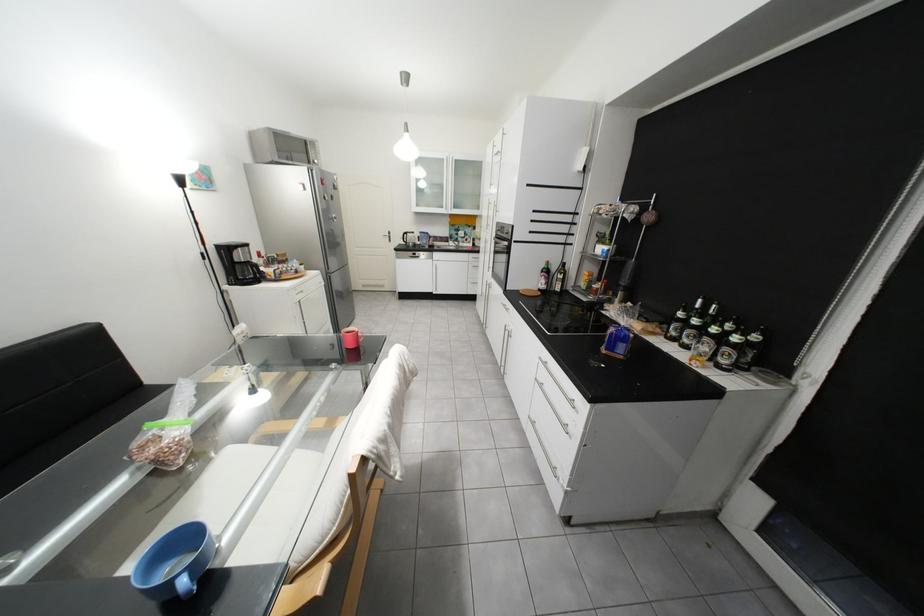
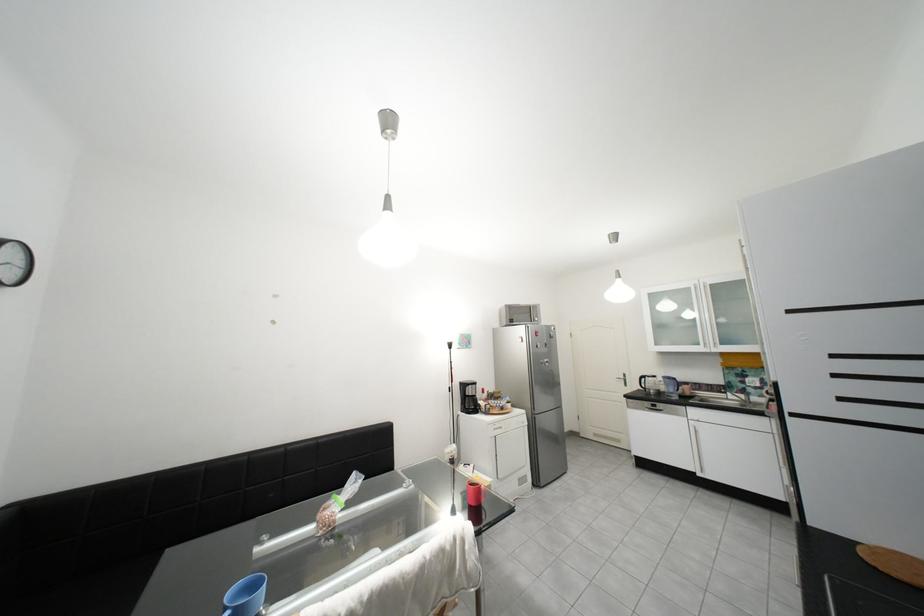
The images are taken continuously from a first-person perspective. In which direction is your viewpoint rotating?

The camera rotated toward left-up.